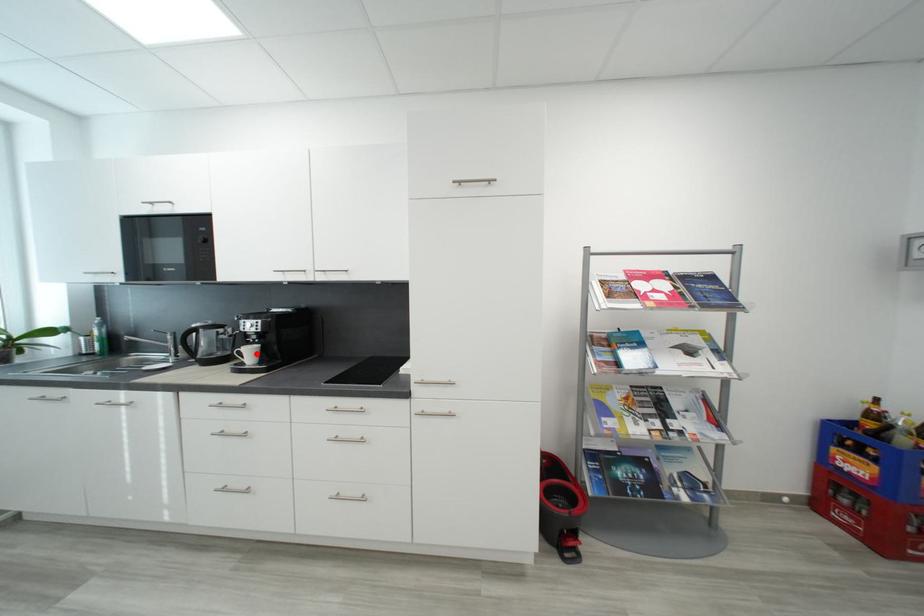
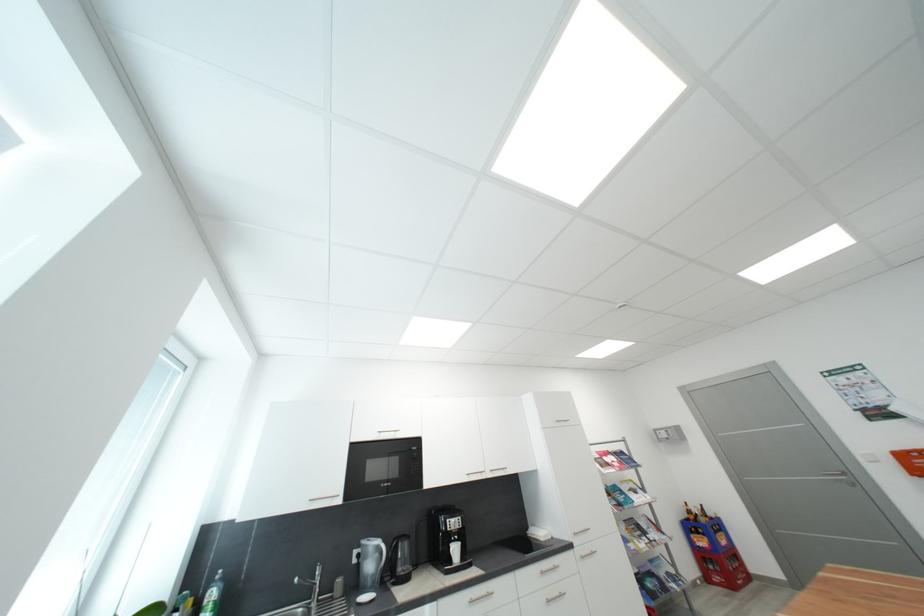
Where in the second image is the point corresponding to the highlighted location from the first image?

(463, 552)